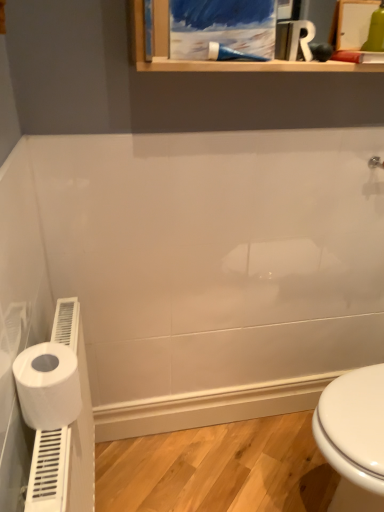
Question: Is white matte toilet paper at left facing towards blue plastic shower at upper center?

Choices:
 (A) yes
 (B) no

Answer: (B)

Question: Is white matte toilet paper at left positioned behind blue plastic shower at upper center?

Choices:
 (A) no
 (B) yes

Answer: (A)

Question: Is white matte toilet paper at left outside blue plastic shower at upper center?

Choices:
 (A) no
 (B) yes

Answer: (B)

Question: From a real-world perspective, is white matte toilet paper at left under blue plastic shower at upper center?

Choices:
 (A) no
 (B) yes

Answer: (B)

Question: Is white matte toilet paper at left far away from blue plastic shower at upper center?

Choices:
 (A) yes
 (B) no

Answer: (B)

Question: Does point (19, 356) appear closer or farther from the camera than point (81, 329)?

Choices:
 (A) farther
 (B) closer

Answer: (B)

Question: In the image, is white matte toilet paper at left on the left side or the right side of white plastic toilet paper holder at lower left?

Choices:
 (A) left
 (B) right

Answer: (B)

Question: In terms of width, does white matte toilet paper at left look wider or thinner when compared to white plastic toilet paper holder at lower left?

Choices:
 (A) thin
 (B) wide

Answer: (B)

Question: In terms of size, does white matte toilet paper at left appear bigger or smaller than white plastic toilet paper holder at lower left?

Choices:
 (A) small
 (B) big

Answer: (A)

Question: Relative to white matte toilet paper at left, is blue plastic shower at upper center in front or behind?

Choices:
 (A) front
 (B) behind

Answer: (B)

Question: Is blue plastic shower at upper center taller or shorter than white matte toilet paper at left?

Choices:
 (A) short
 (B) tall

Answer: (A)

Question: From a real-world perspective, is blue plastic shower at upper center physically located above or below white matte toilet paper at left?

Choices:
 (A) above
 (B) below

Answer: (A)

Question: From the image's perspective, is blue plastic shower at upper center located above or below white matte toilet paper at left?

Choices:
 (A) above
 (B) below

Answer: (A)

Question: In terms of size, does white plastic toilet paper holder at lower left appear bigger or smaller than blue plastic shower at upper center?

Choices:
 (A) small
 (B) big

Answer: (B)

Question: Considering their positions, is white plastic toilet paper holder at lower left located in front of or behind blue plastic shower at upper center?

Choices:
 (A) front
 (B) behind

Answer: (A)